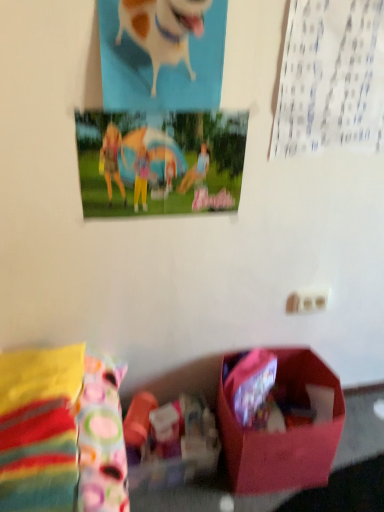
Question: Is white glossy dog at upper center bigger than matte pink box at lower center?

Choices:
 (A) yes
 (B) no

Answer: (B)

Question: Is white glossy dog at upper center completely or partially outside of matte pink box at lower center?

Choices:
 (A) yes
 (B) no

Answer: (A)

Question: Is white glossy dog at upper center oriented towards matte pink box at lower center?

Choices:
 (A) yes
 (B) no

Answer: (B)

Question: Would you say white glossy dog at upper center contains matte pink box at lower center?

Choices:
 (A) yes
 (B) no

Answer: (B)

Question: Is white glossy dog at upper center behind matte pink box at lower center?

Choices:
 (A) yes
 (B) no

Answer: (B)

Question: In terms of width, does white glossy dog at upper center look wider or thinner when compared to matte plastic poster at upper center?

Choices:
 (A) wide
 (B) thin

Answer: (A)

Question: From a real-world perspective, is white glossy dog at upper center above or below matte plastic poster at upper center?

Choices:
 (A) above
 (B) below

Answer: (A)

Question: Is white glossy dog at upper center taller or shorter than matte plastic poster at upper center?

Choices:
 (A) short
 (B) tall

Answer: (B)

Question: Is white glossy dog at upper center to the left or to the right of matte plastic poster at upper center in the image?

Choices:
 (A) right
 (B) left

Answer: (A)

Question: Is matte pink box at lower center bigger or smaller than white glossy dog at upper center?

Choices:
 (A) big
 (B) small

Answer: (A)

Question: Would you say matte pink box at lower center is to the left or to the right of white glossy dog at upper center in the picture?

Choices:
 (A) left
 (B) right

Answer: (B)

Question: From a real-world perspective, is matte pink box at lower center positioned above or below white glossy dog at upper center?

Choices:
 (A) above
 (B) below

Answer: (B)

Question: In terms of height, does matte pink box at lower center look taller or shorter compared to white glossy dog at upper center?

Choices:
 (A) short
 (B) tall

Answer: (A)

Question: Considering the positions of matte plastic poster at upper center and white glossy dog at upper center in the image, is matte plastic poster at upper center bigger or smaller than white glossy dog at upper center?

Choices:
 (A) small
 (B) big

Answer: (A)

Question: Would you say matte plastic poster at upper center is inside or outside white glossy dog at upper center?

Choices:
 (A) inside
 (B) outside

Answer: (B)